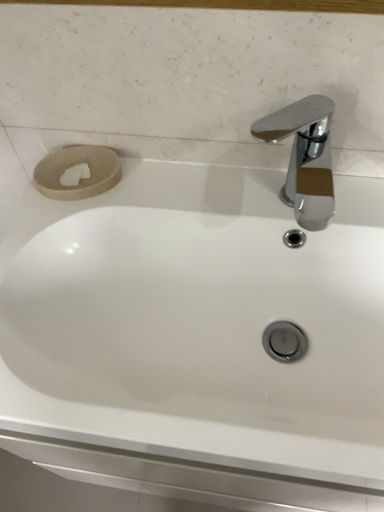
Identify the location of free spot to the right of beige matte toilet paper at upper left. (185, 183).